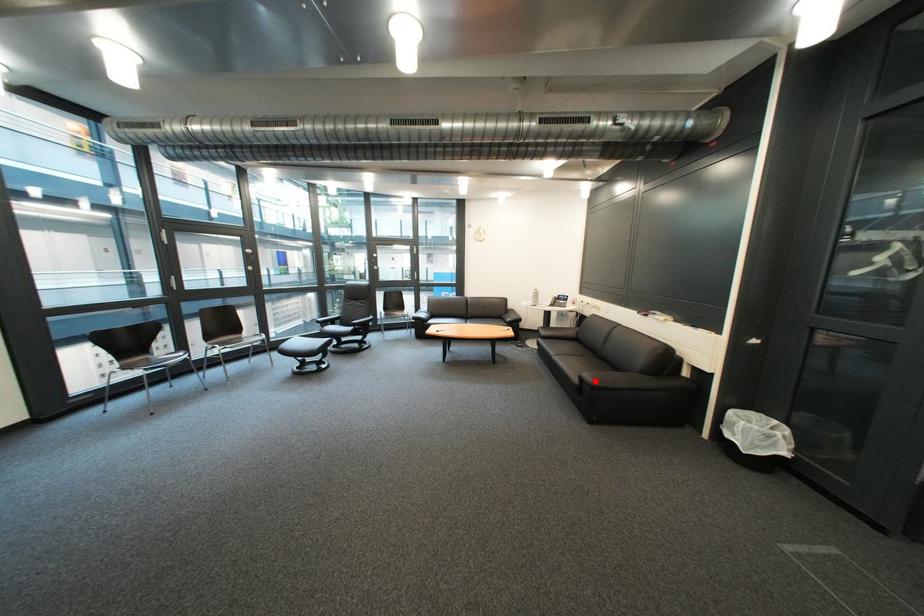
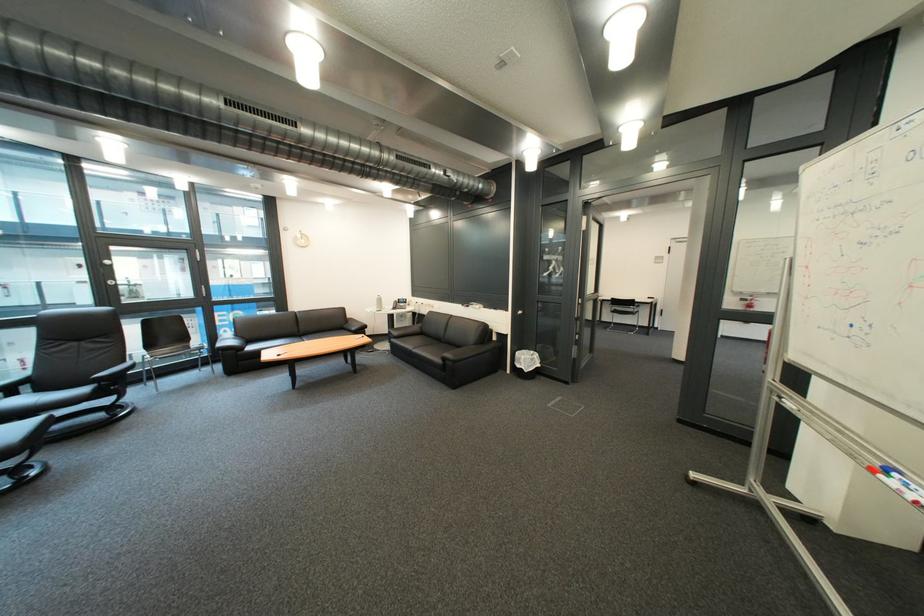
The point at the highlighted location is marked in the first image. Where is the corresponding point in the second image?

(457, 361)